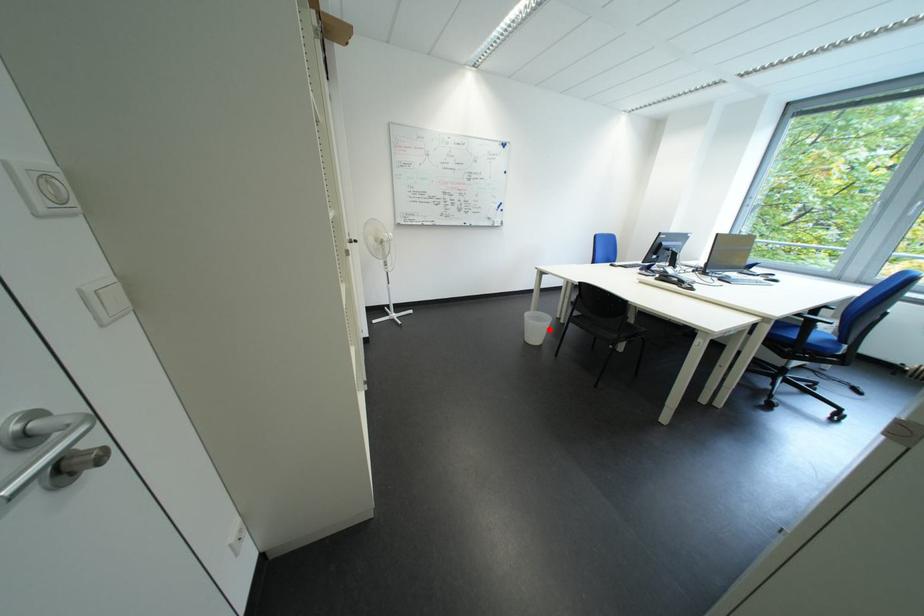
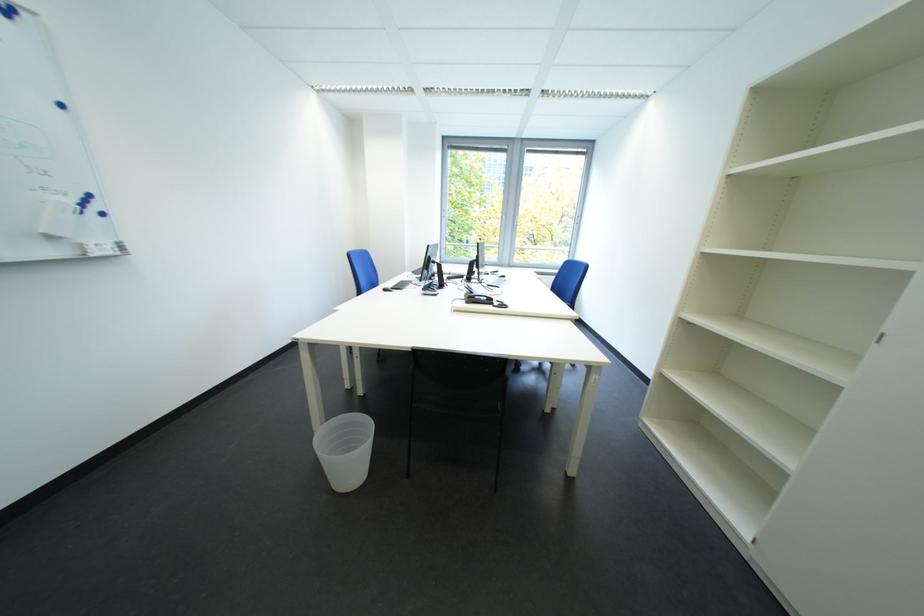
Question: I am providing you with two images of the same scene from different viewpoints. Image1 has a red point marked. In image2, the corresponding 3D location appears at what relative position? Reply with the corresponding letter.

Choices:
 (A) Closer
 (B) Farther

Answer: (B)